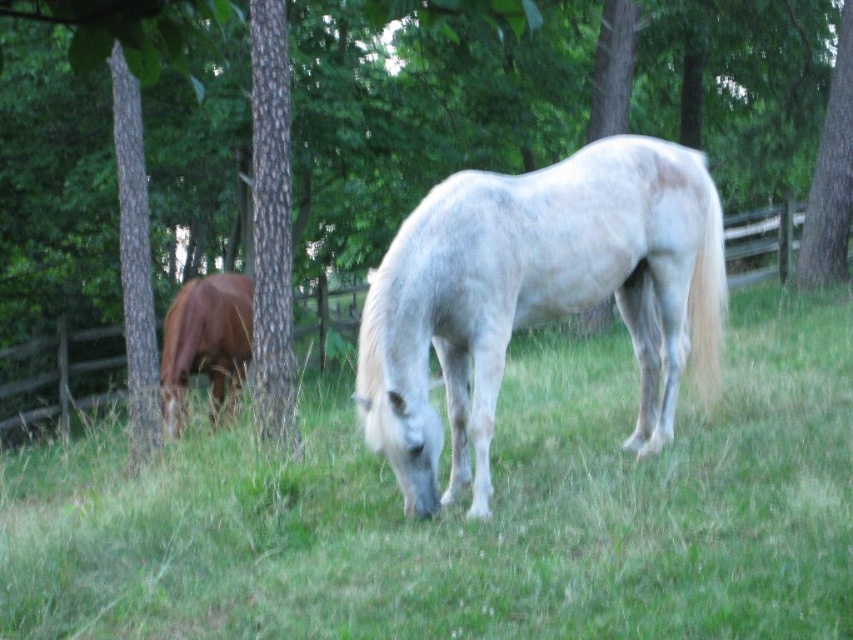
Question: Does green bark tree at center have a lesser width compared to smooth bark tree at center right?

Choices:
 (A) yes
 (B) no

Answer: (B)

Question: Is green grass at center positioned before white matte horse at center?

Choices:
 (A) no
 (B) yes

Answer: (B)

Question: Which object is the farthest from the brown glossy horse at left?

Choices:
 (A) green bark tree at center
 (B) green grass at center
 (C) smooth bark tree at center right
 (D) white matte horse at center

Answer: (C)

Question: Which of the following is the closest to the observer?

Choices:
 (A) (263, 276)
 (B) (122, 308)
 (C) (670, 8)

Answer: (A)

Question: Can you confirm if brown rough bark tree at center is positioned below brown glossy horse at left?

Choices:
 (A) no
 (B) yes

Answer: (A)

Question: Among these objects, which one is nearest to the camera?

Choices:
 (A) smooth bark tree trunk at left
 (B) green bark tree at center
 (C) green grass at center
 (D) smooth bark tree at center right

Answer: (B)